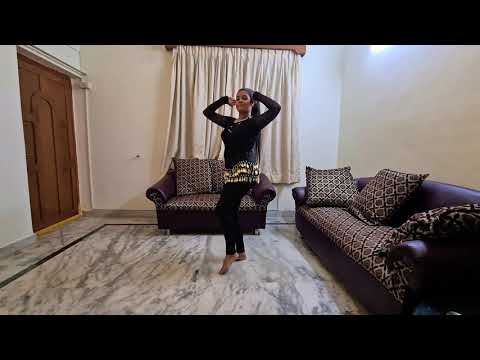
You are a GUI agent. You are given a task and a screenshot of the screen. Output one action in this format:
    pyautogui.click(x=<x>, y=<y>)
    Task: Click on the door
    The height and width of the screenshot is (360, 480).
    Given the screenshot: What is the action you would take?
    pyautogui.click(x=48, y=144)